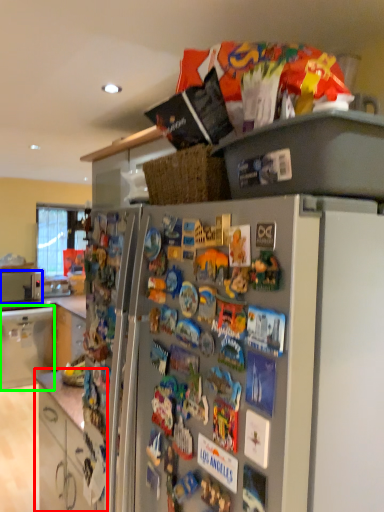
Question: Which object is the closest to the cabinetry (highlighted by a red box)? Choose among these: appliance (highlighted by a blue box) or cabinetry (highlighted by a green box).

Choices:
 (A) appliance
 (B) cabinetry

Answer: (B)